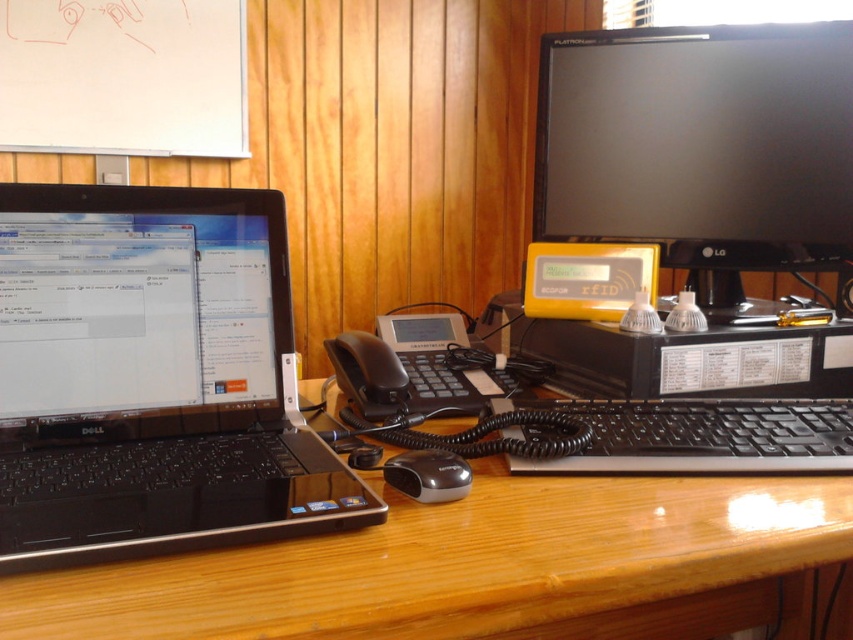
Question: Is wooden at center thinner than black glossy monitor at upper right?

Choices:
 (A) no
 (B) yes

Answer: (A)

Question: Which of the following is the farthest from the observer?

Choices:
 (A) click(x=563, y=468)
 (B) click(x=769, y=68)
 (C) click(x=630, y=588)

Answer: (B)

Question: Which object appears farthest from the camera in this image?

Choices:
 (A) black glossy monitor at upper right
 (B) black matte laptop at left
 (C) black rubberized mouse at center

Answer: (A)

Question: Is wooden at center in front of black plastic keyboard at center?

Choices:
 (A) no
 (B) yes

Answer: (B)

Question: Which is nearer to the wooden at center?

Choices:
 (A) black matte laptop at left
 (B) black glossy monitor at upper right
 (C) black rubberized mouse at center

Answer: (C)

Question: Can you confirm if wooden at center is positioned to the right of black rubberized mouse at center?

Choices:
 (A) yes
 (B) no

Answer: (B)